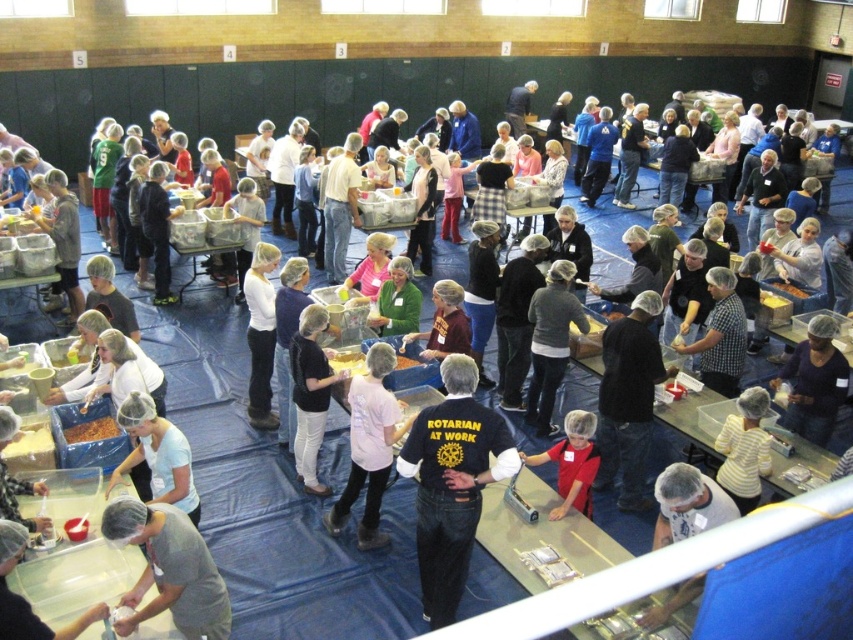
In the scene shown: You are a volunteer at the food packing event and need to locate the pink fabric shirt at center and the light blue fabric at lower left. Which object is covering the other one?

The pink fabric shirt at center is positioned over light blue fabric at lower left, so it is covering the light blue fabric at lower left.

You are standing at the entrance of the gymnasium and see the point labeled as point (157, 454). What object is located at that point?

The point (157, 454) corresponds to the light blue fabric at lower left.